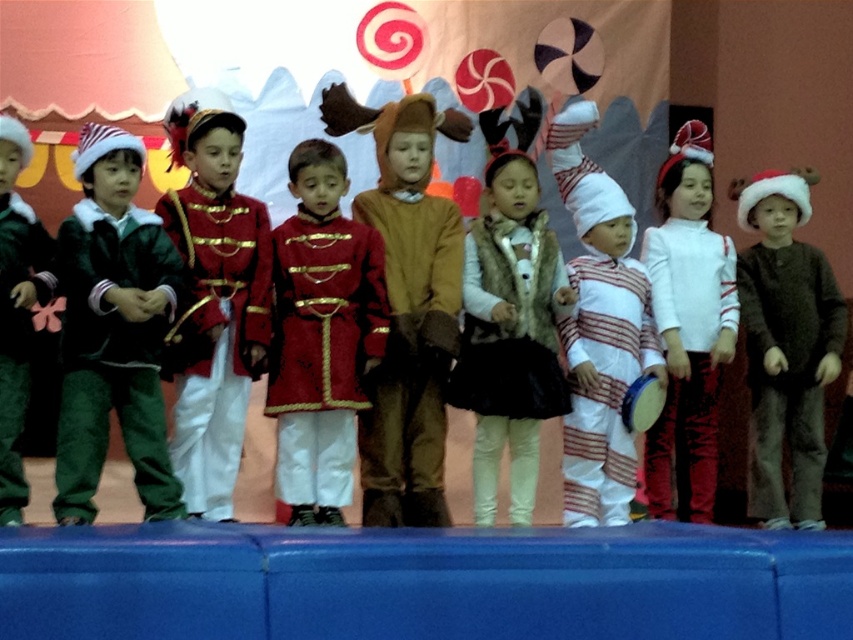
Does point (564, 467) come in front of point (650, 504)?

Yes, it is.

Which of these two, white striped fabric at center or white matte dress at center, stands taller?

With more height is white striped fabric at center.

Find the location of a particular element. This screenshot has height=640, width=853. white striped fabric at center is located at coordinates (599, 330).

Find the location of a particular element. This screenshot has width=853, height=640. white striped fabric at center is located at coordinates (599, 330).

Is shiny red uniform at center thinner than brown wool sweater at center?

Incorrect, shiny red uniform at center's width is not less than brown wool sweater at center's.

What do you see at coordinates (321, 336) in the screenshot? Image resolution: width=853 pixels, height=640 pixels. I see `shiny red uniform at center` at bounding box center [321, 336].

Locate an element on the screen. shiny red uniform at center is located at coordinates (321, 336).

Does green fabric coat at left have a larger size compared to white matte dress at center?

Correct, green fabric coat at left is larger in size than white matte dress at center.

Is green fabric coat at left above white matte dress at center?

Indeed, green fabric coat at left is positioned over white matte dress at center.

At what (x,y) coordinates should I click in order to perform the action: click on green fabric coat at left. Please return your answer as a coordinate pair (x, y). The image size is (853, 640). Looking at the image, I should click on (113, 330).

Find the location of a particular element. The image size is (853, 640). green fabric coat at left is located at coordinates (113, 330).